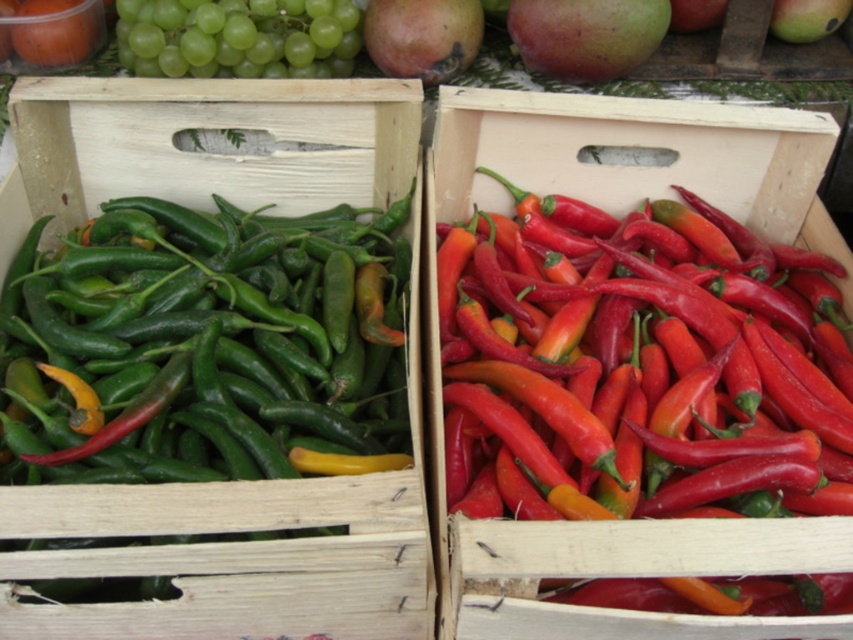
Locate an element on the screen. matte wood box at center is located at coordinates (621, 214).

You are a GUI agent. You are given a task and a screenshot of the screen. Output one action in this format:
    pyautogui.click(x=<x>, y=<y>)
    Task: Click on the matte wood box at center
    Image resolution: width=853 pixels, height=640 pixels.
    Given the screenshot: What is the action you would take?
    pyautogui.click(x=621, y=214)

This screenshot has width=853, height=640. In order to click on matte wood box at center in this screenshot , I will do `click(621, 214)`.

Is matte wood box at center further to camera compared to green matte mango at upper right?

No, it is not.

The width and height of the screenshot is (853, 640). I want to click on matte wood box at center, so click(621, 214).

Does green matte chili peppers at left have a lesser height compared to green matte mango at upper right?

Incorrect, green matte chili peppers at left's height does not fall short of green matte mango at upper right's.

Is green matte chili peppers at left bigger than green matte mango at upper right?

Yes, green matte chili peppers at left is bigger than green matte mango at upper right.

Locate an element on the screen. green matte chili peppers at left is located at coordinates (212, 211).